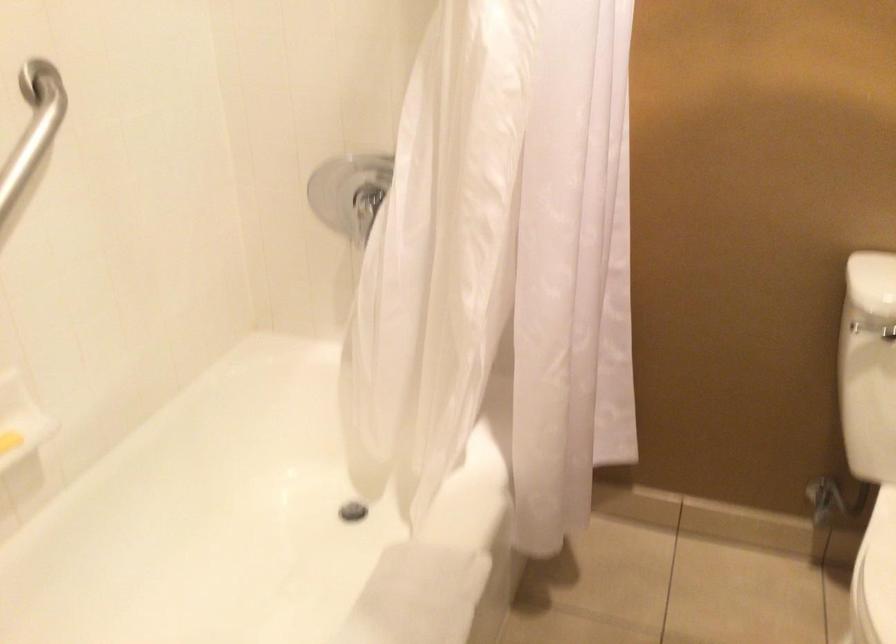
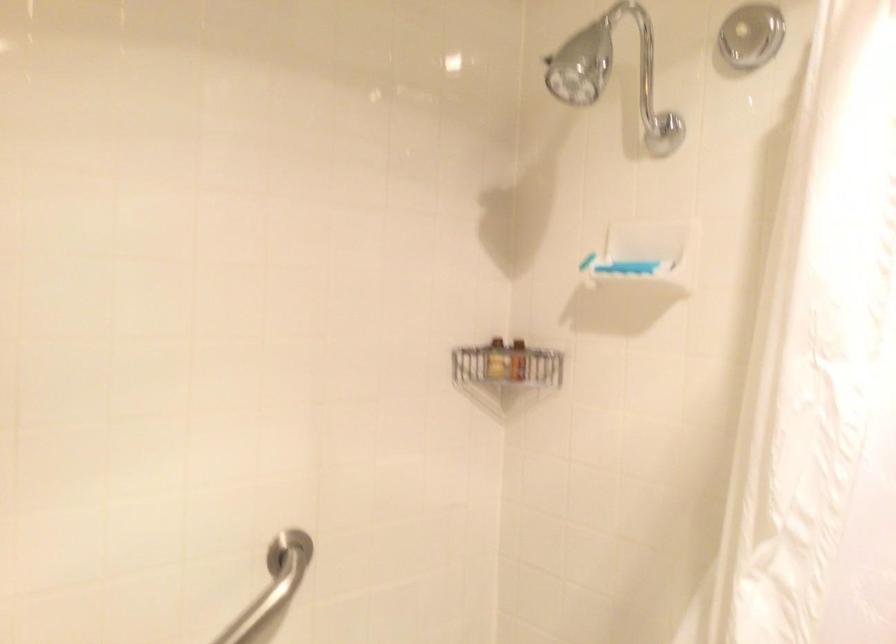
First-person continuous shooting, in which direction is the camera rotating?

The rotation direction of the camera is left-up.